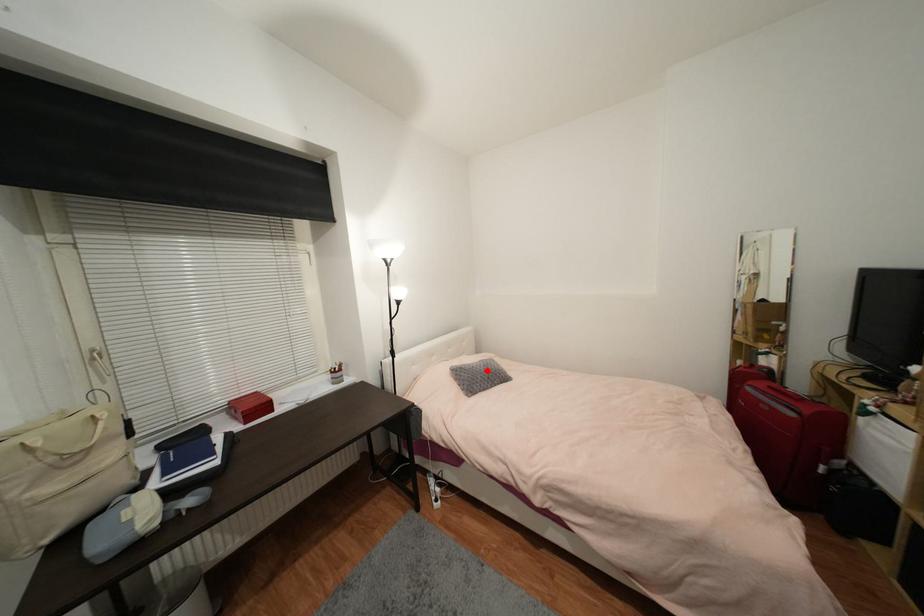
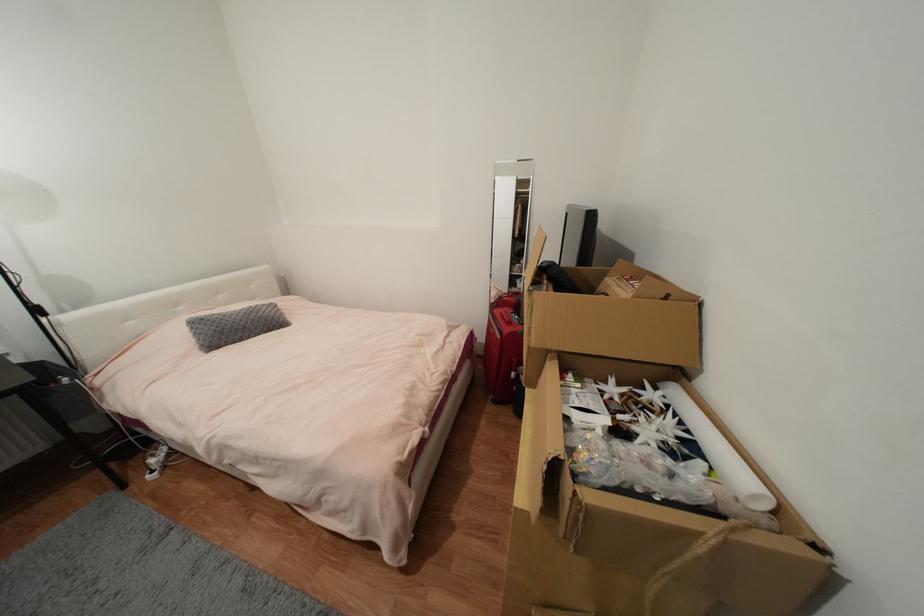
In the second image, find the point that corresponds to the highlighted location in the first image.

(244, 320)